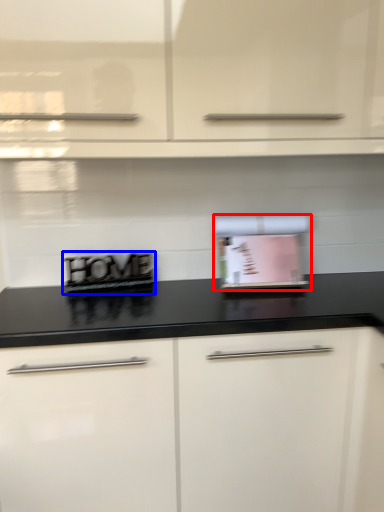
Question: Which object is further to the camera taking this photo, appliance (highlighted by a red box) or appliance (highlighted by a blue box)?

Choices:
 (A) appliance
 (B) appliance

Answer: (B)